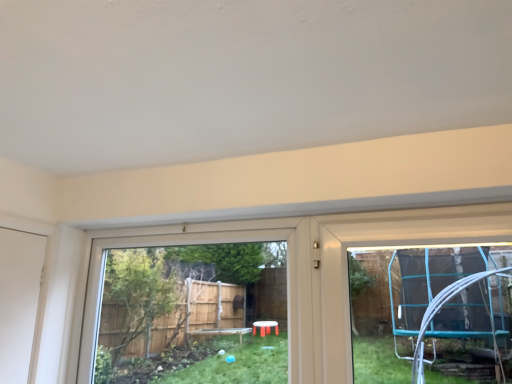
The height and width of the screenshot is (384, 512). I want to click on transparent glass window at center, so click(181, 244).

What do you see at coordinates (181, 244) in the screenshot?
I see `transparent glass window at center` at bounding box center [181, 244].

Where is `transparent glass window at center`? transparent glass window at center is located at coordinates (181, 244).